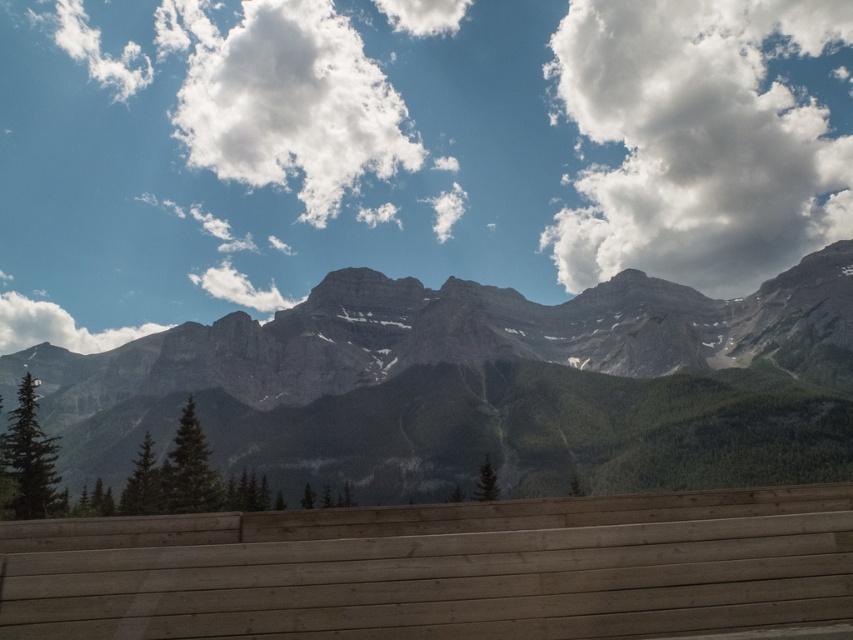
Question: Which point is closer to the camera taking this photo?

Choices:
 (A) (305, 145)
 (B) (13, 333)
 (C) (401, 429)

Answer: (C)

Question: Which object appears closest to the camera in this image?

Choices:
 (A) natural wood park bench at lower center
 (B) white fluffy cloud at upper right

Answer: (A)

Question: Observing the image, what is the correct spatial positioning of gray rock mountain range at center in reference to natural wood park bench at lower center?

Choices:
 (A) left
 (B) right

Answer: (A)

Question: Can you confirm if gray rock mountain range at center is positioned above white fluffy cloud at upper center?

Choices:
 (A) no
 (B) yes

Answer: (A)

Question: Can you confirm if white fluffy cloud at upper right is positioned to the left of white fluffy cloud at upper left?

Choices:
 (A) no
 (B) yes

Answer: (A)

Question: Which object is closer to the camera taking this photo?

Choices:
 (A) natural wood park bench at lower center
 (B) white fluffy cloud at upper center
 (C) gray rock mountain range at center
 (D) white fluffy cloud at upper right

Answer: (A)